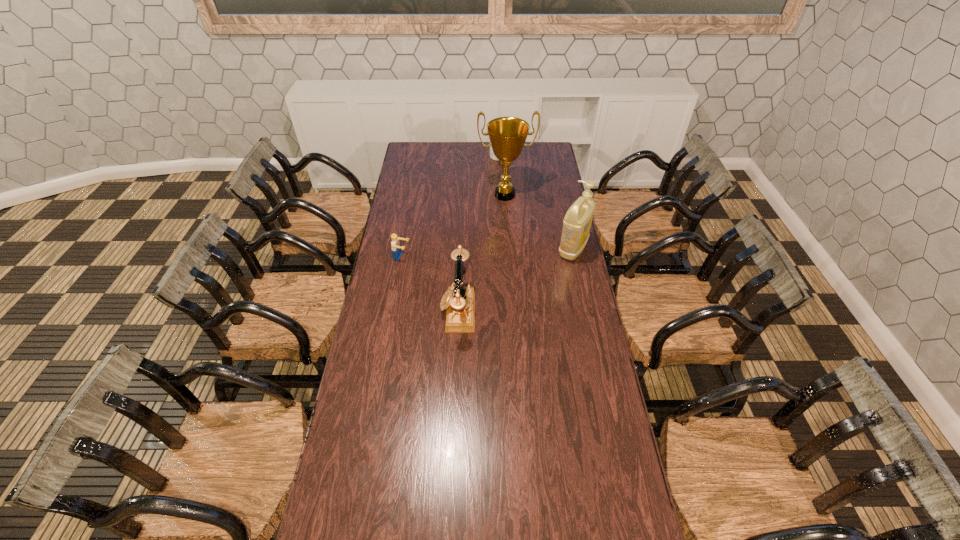
Locate an element on the screen. vacant point located 0.210m on the dial of the nearest object is located at coordinates (389, 310).

Where is `blank area located 0.180m on the front of the second tallest object`? blank area located 0.180m on the front of the second tallest object is located at coordinates (583, 294).

Locate an element on the screen. Image resolution: width=960 pixels, height=540 pixels. free space located with the handle on the side of the farthest object is located at coordinates (507, 195).

At what (x,y) coordinates should I click in order to perform the action: click on vacant point located with the handle on the side of the farthest object. Please return your answer as a coordinate pair (x, y). Looking at the image, I should click on (508, 199).

Identify the location of free location located 0.220m with the handle on the side of the farthest object. pos(505,187).

Where is `free spot located 0.330m on the face of the Lego`? This screenshot has width=960, height=540. free spot located 0.330m on the face of the Lego is located at coordinates (481, 273).

Locate an element on the screen. vacant position located 0.350m on the face of the Lego is located at coordinates (485, 274).

The height and width of the screenshot is (540, 960). I want to click on blank space located 0.400m on the face of the Lego, so click(496, 276).

This screenshot has width=960, height=540. I want to click on vacant space situated on the front view with handles of the award, so click(510, 237).

Locate an element on the screen. Image resolution: width=960 pixels, height=540 pixels. blank space located on the front view with handles of the award is located at coordinates (508, 221).